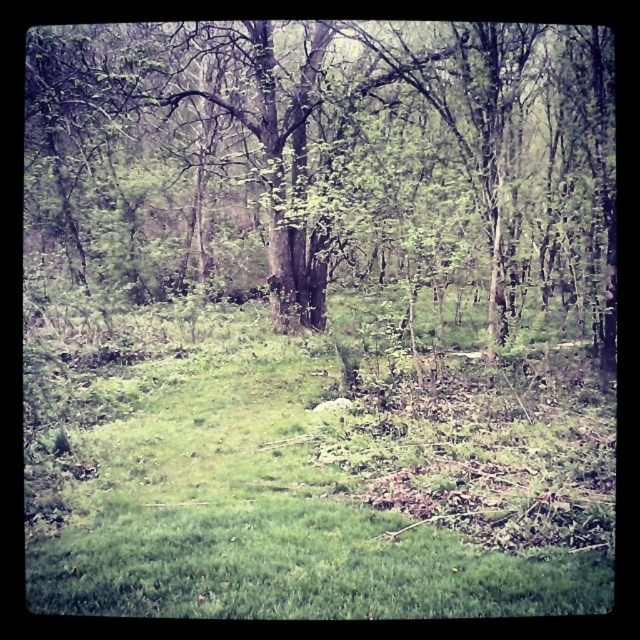
Question: Which point appears farthest from the camera in this image?

Choices:
 (A) (477, 208)
 (B) (481, 364)

Answer: (B)

Question: Can you confirm if green grassy at center is thinner than green leafy tree at center?

Choices:
 (A) no
 (B) yes

Answer: (B)

Question: Is green grassy at center further to the viewer compared to green leafy tree at center?

Choices:
 (A) no
 (B) yes

Answer: (A)

Question: Is green grassy at center thinner than green leafy tree at center?

Choices:
 (A) no
 (B) yes

Answer: (B)